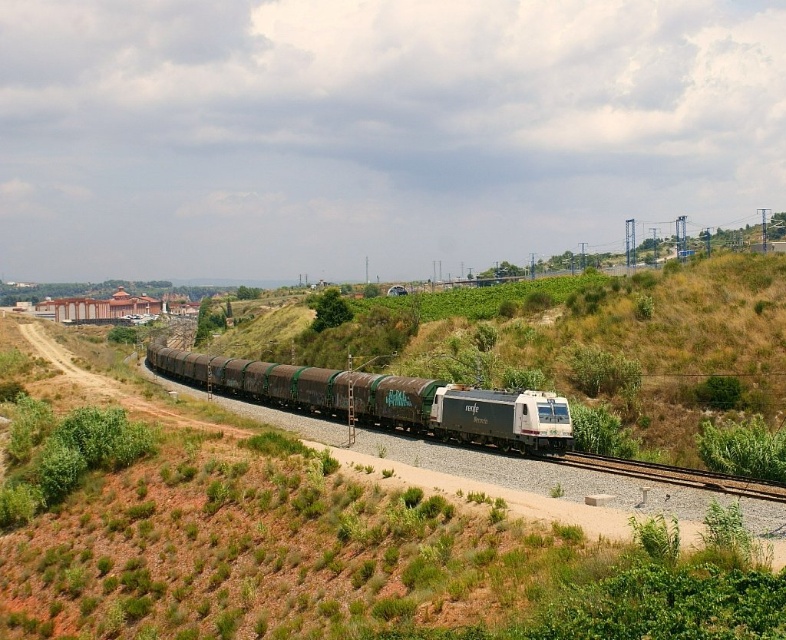
You are standing at the origin point in the image. The matte brown train carriages at center are located at coordinates given. Can you tell me their exact coordinates?

The matte brown train carriages at center are exactly at point (384,400).

You are a photographer positioned at the camera location aiming to capture the two points in the railway scene. Which point, point (309, 376) or point (693, 483), is closer to your current position?

Point (309, 376) is further to the camera than point (693, 483). Therefore, point (693, 483) is closer to your current position.

You are standing on the railway platform waiting for the train to pass. The platform is 150 feet long. Can the entire matte brown train carriages at center fit on the platform once the train stops?

The matte brown train carriages at center are 138.45 feet away from the viewer. Since the platform is 150 feet long, the entire matte brown train carriages at center can fit on the platform once the train stops.